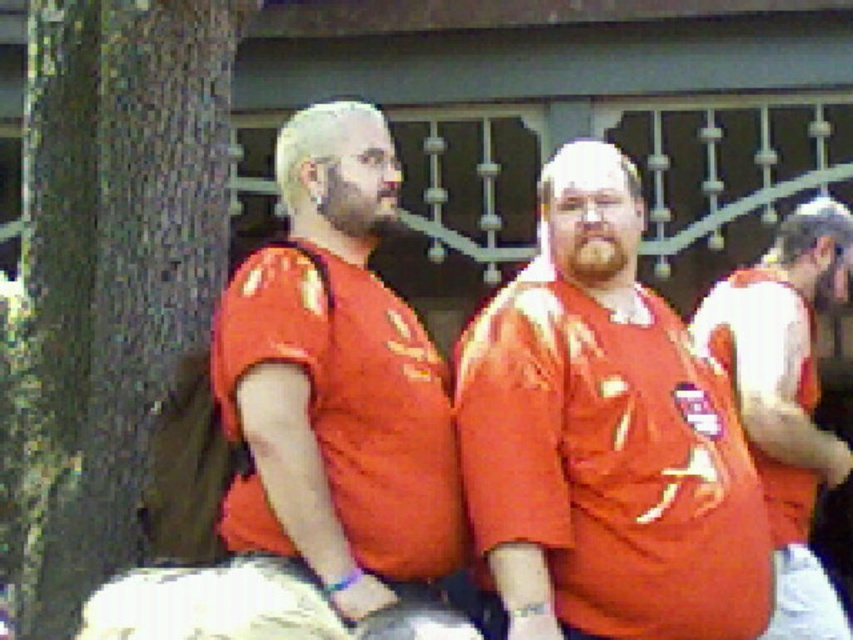
You are a photographer trying to capture a closeup of the brown rough bark at left while also including the matte orange shirt at center in the shot. Which object will appear wider in the photo?

The matte orange shirt at center will appear wider in the photo because it has a greater width than the brown rough bark at left according to the description.